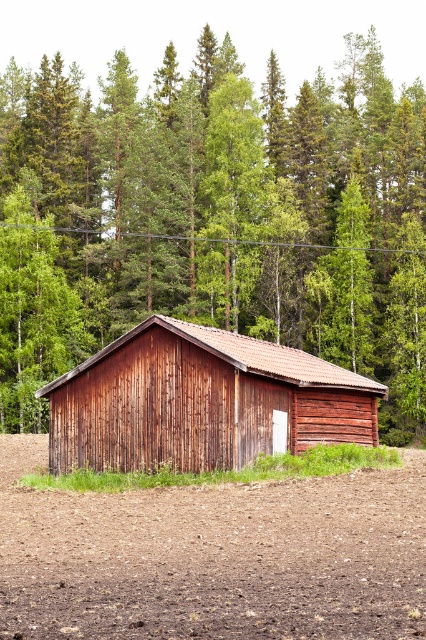
Which is in front, point (230, 74) or point (261, 400)?

Point (261, 400)

Who is positioned more to the left, brown wooden house at center or wooden barn at center?

Positioned to the left is brown wooden house at center.

Where is `brown wooden house at center`? The width and height of the screenshot is (426, 640). brown wooden house at center is located at coordinates (213, 216).

Locate an element on the screen. This screenshot has height=640, width=426. brown wooden house at center is located at coordinates (213, 216).

What do you see at coordinates (213, 556) in the screenshot? Image resolution: width=426 pixels, height=640 pixels. I see `brown soil at lower center` at bounding box center [213, 556].

Can you confirm if brown soil at lower center is wider than wooden barn at center?

Indeed, brown soil at lower center has a greater width compared to wooden barn at center.

Who is more distant from viewer, (x=362, y=481) or (x=359, y=412)?

The point (x=359, y=412) is behind.

This screenshot has height=640, width=426. I want to click on brown soil at lower center, so click(x=213, y=556).

Between point (161, 246) and point (345, 483), which one is positioned behind?

Positioned behind is point (161, 246).

Which of these two, brown wooden house at center or brown soil at lower center, stands taller?

brown wooden house at center

Measure the distance between brown wooden house at center and camera.

brown wooden house at center and camera are 71.30 meters apart from each other.

I want to click on brown wooden house at center, so (x=213, y=216).